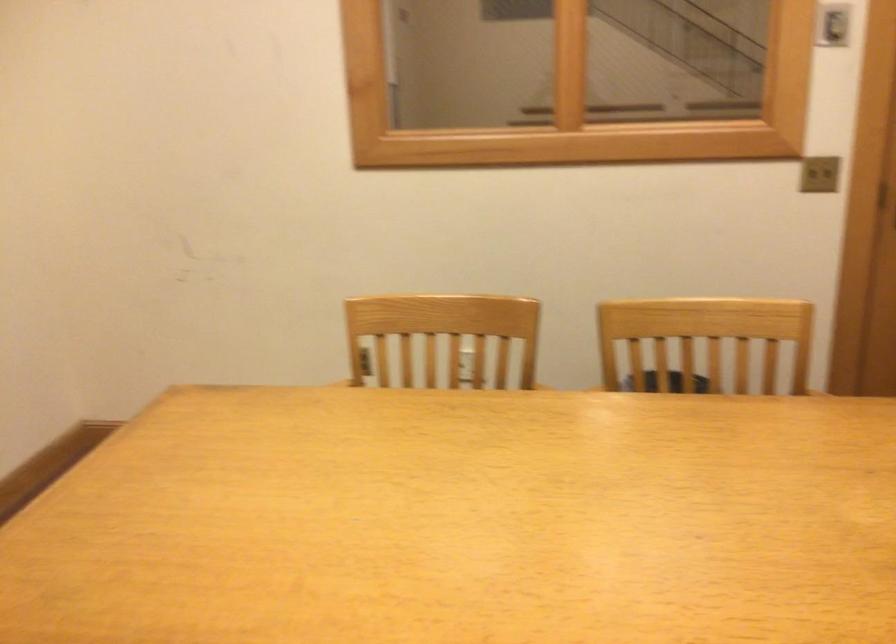
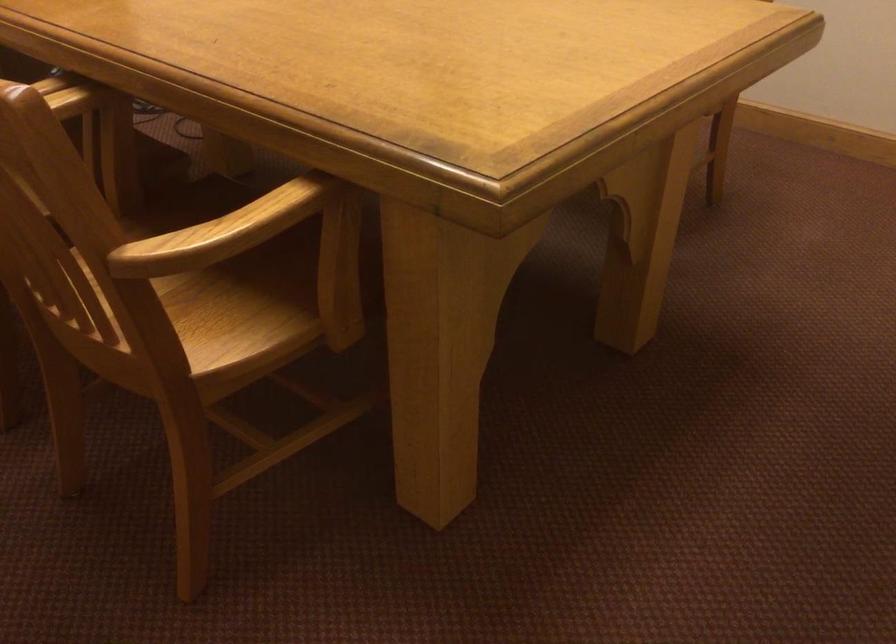
Find the pixel in the second image that matches the point at 300,401 in the first image.

(221, 232)